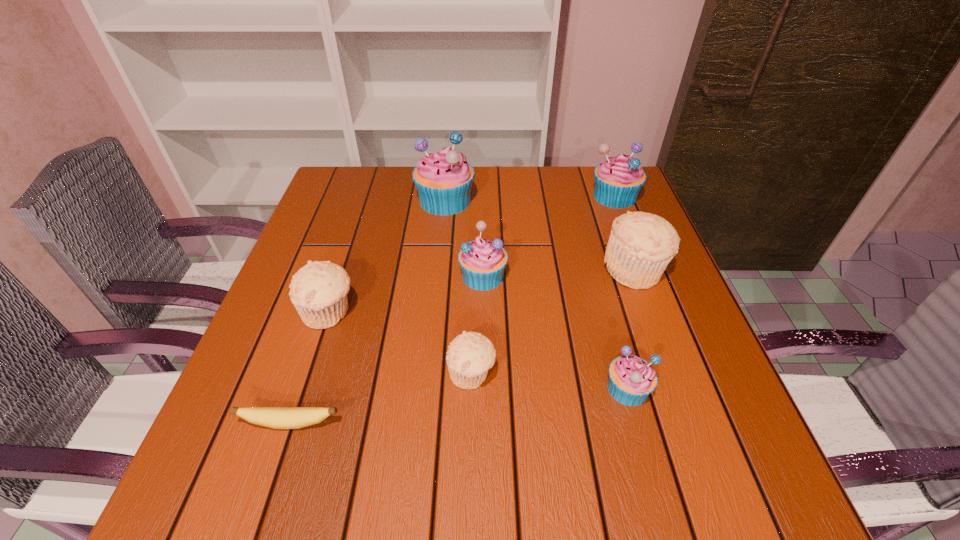
I want to click on free space located on the right of the nearest object, so (561, 423).

This screenshot has height=540, width=960. I want to click on muffin present at the left edge, so click(x=318, y=291).

At what (x,y) coordinates should I click in order to perform the action: click on banana at the left edge. Please return your answer as a coordinate pair (x, y). The width and height of the screenshot is (960, 540). Looking at the image, I should click on (274, 417).

Image resolution: width=960 pixels, height=540 pixels. I want to click on object that is at the far right corner, so click(618, 180).

Image resolution: width=960 pixels, height=540 pixels. I want to click on vacant space at the far edge of the desktop, so click(x=390, y=195).

Where is `free space at the near edge of the desktop`? This screenshot has height=540, width=960. free space at the near edge of the desktop is located at coordinates (521, 456).

In the image, there is a desktop. Where is `vacant space at the left edge`? This screenshot has height=540, width=960. vacant space at the left edge is located at coordinates (289, 322).

This screenshot has height=540, width=960. Find the location of `vacant space at the right edge of the desktop`. vacant space at the right edge of the desktop is located at coordinates (627, 337).

In the image, there is a desktop. At what (x,y) coordinates should I click in order to perform the action: click on blank space at the far left corner. Please return your answer as a coordinate pair (x, y). The width and height of the screenshot is (960, 540). Looking at the image, I should click on (351, 181).

Identify the location of vacant space at the far right corner of the desktop. This screenshot has height=540, width=960. (594, 206).